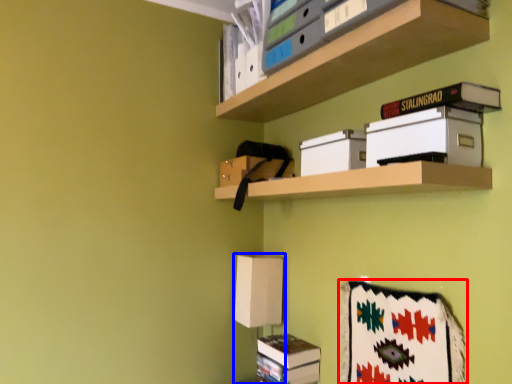
Question: Which object is closer to the camera taking this photo, blanket (highlighted by a red box) or table lamp (highlighted by a blue box)?

Choices:
 (A) blanket
 (B) table lamp

Answer: (A)